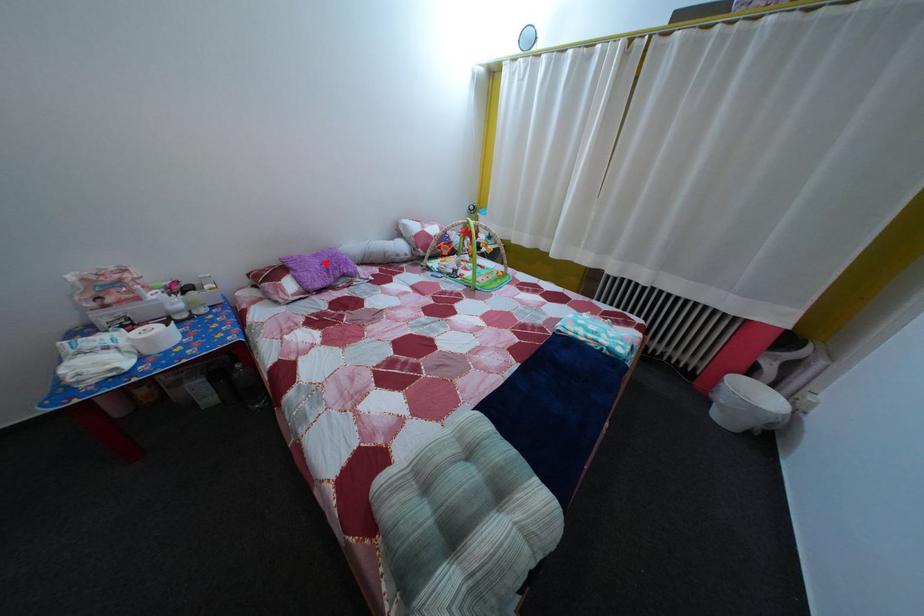
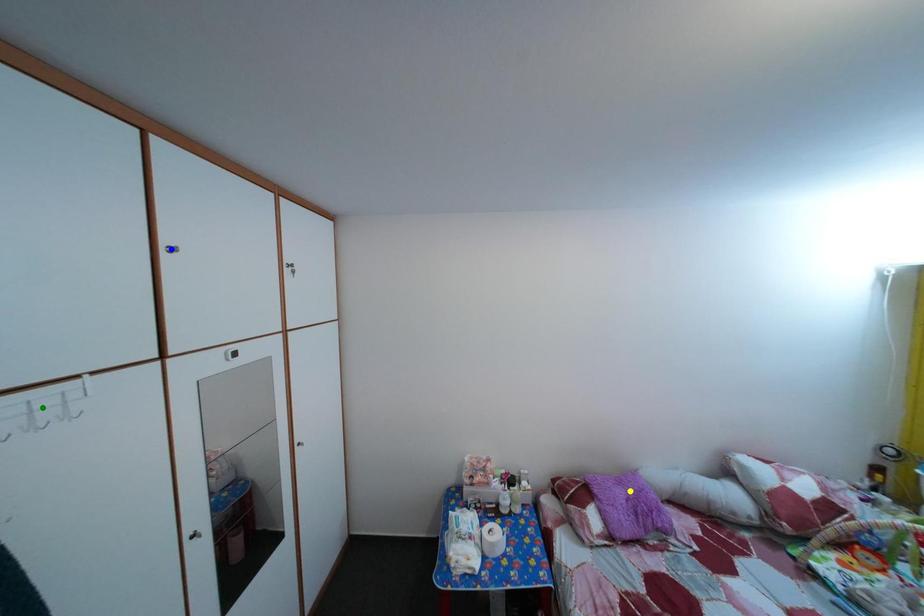
Question: I am providing you with two images of the same scene from different viewpoints. A red point is marked on the first image. You are given multiple points on the second image. Which point in image 2 represents the same 3d spot as the red point in image 1?

Choices:
 (A) yellow point
 (B) green point
 (C) blue point

Answer: (A)